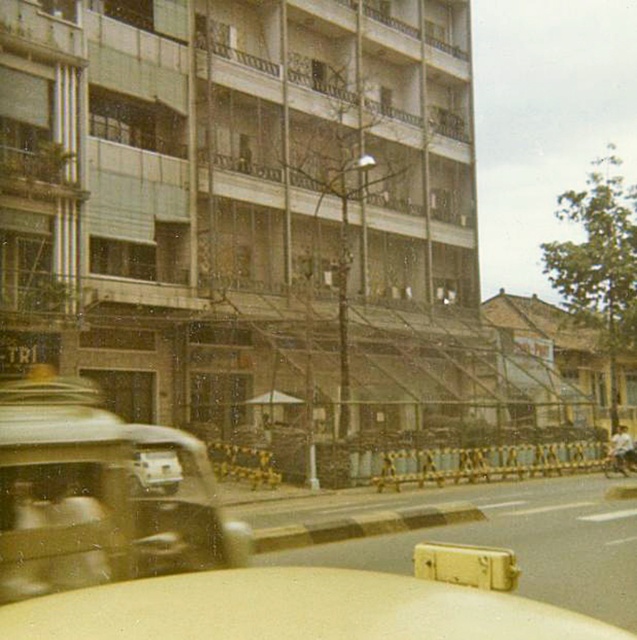
You are a photographer trying to capture a wide shot of the street scene. You need to ensure both the metallic gold car at left and the shiny chrome motorcycle at right fit in the frame. Based on their sizes, which vehicle should you prioritize positioning closer to the center to avoid cropping?

The metallic gold car at left is wider than the shiny chrome motorcycle at right. To avoid cropping, prioritize positioning the metallic gold car at left closer to the center since it requires more space in the frame.

You are standing at the origin point in the image and need to reach the yellow matte car at center. According to the coordinates provided, in which direction should you move first?

The yellow matte car at center is located at coordinates approximately 0.866 on the x axis and 0.298 on the y axis. Since you are at the origin, you should move primarily in the positive x direction first to reach the car.

You are a photographer positioned at the street level, and you want to take a photo of both the yellow matte car at center and the metallic gold car at left. Which car should you focus on first to ensure both are in sharp focus?

The yellow matte car at center is closer to the viewer than the metallic gold car at left. To ensure both are in sharp focus, you should focus on the metallic gold car at left first because it is farther away, allowing the depth of field to cover the closer car as well.